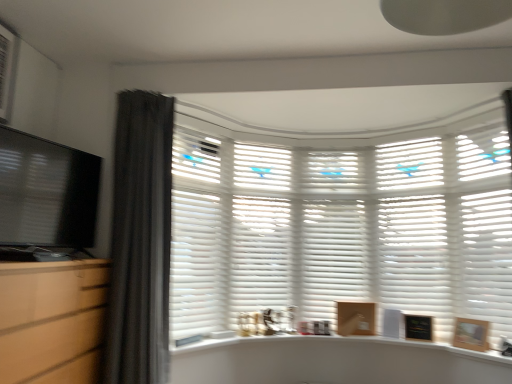
Question: From a real-world perspective, is white matte shutter at right, which is the first shutter in right-to-left order, under black matte picture frame at lower right, acting as the 2th picture frame starting from the right?

Choices:
 (A) yes
 (B) no

Answer: (B)

Question: Can you confirm if white matte shutter at right, which is the first shutter in right-to-left order, is positioned to the right of black matte picture frame at lower right, which is the second picture frame from front to back?

Choices:
 (A) no
 (B) yes

Answer: (B)

Question: Is there a large distance between white matte shutter at right, which is the first shutter in right-to-left order, and black matte picture frame at lower right, acting as the 2th picture frame starting from the right?

Choices:
 (A) no
 (B) yes

Answer: (A)

Question: Can you confirm if white matte shutter at right, which is the first shutter in right-to-left order, is thinner than black matte picture frame at lower right, which is the second picture frame from front to back?

Choices:
 (A) no
 (B) yes

Answer: (A)

Question: Is white matte shutter at right, the 5th shutter when ordered from left to right, next to black matte picture frame at lower right, acting as the 2th picture frame starting from the right?

Choices:
 (A) no
 (B) yes

Answer: (A)

Question: Is black matte picture frame at lower right, which is the second picture frame from front to back, at the back of white matte shutter at right, the 5th shutter when ordered from left to right?

Choices:
 (A) no
 (B) yes

Answer: (A)

Question: Is dark gray fabric curtain at left oriented away from wooden picture frame at lower right, which is the 2th picture frame in left-to-right order?

Choices:
 (A) yes
 (B) no

Answer: (B)

Question: Can wooden picture frame at lower right, which is the 2th picture frame in left-to-right order, be found inside dark gray fabric curtain at left?

Choices:
 (A) no
 (B) yes

Answer: (A)

Question: From a real-world perspective, is dark gray fabric curtain at left located higher than wooden picture frame at lower right, the first picture frame viewed from the front?

Choices:
 (A) yes
 (B) no

Answer: (A)

Question: Is dark gray fabric curtain at left bigger than wooden picture frame at lower right, the first picture frame viewed from the front?

Choices:
 (A) no
 (B) yes

Answer: (B)

Question: Is dark gray fabric curtain at left at the left side of wooden picture frame at lower right, the first picture frame viewed from the front?

Choices:
 (A) no
 (B) yes

Answer: (B)

Question: Would you say dark gray fabric curtain at left is a long distance from wooden picture frame at lower right, which ranks as the 1th picture frame in right-to-left order?

Choices:
 (A) no
 (B) yes

Answer: (B)

Question: Is wooden picture frame at lower right, which is the 2th picture frame in left-to-right order, to the left of white matte counter top at center from the viewer's perspective?

Choices:
 (A) no
 (B) yes

Answer: (A)